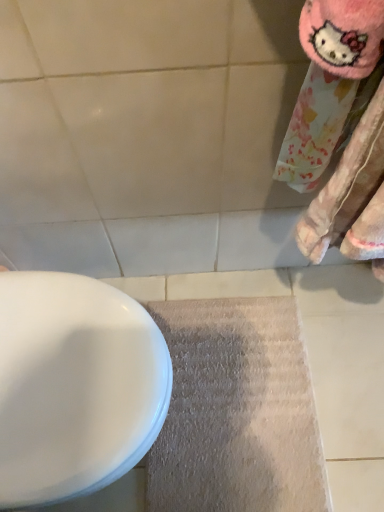
Identify the location of white glossy toilet at lower left. (75, 386).

This screenshot has width=384, height=512. What do you see at coordinates (75, 386) in the screenshot?
I see `white glossy toilet at lower left` at bounding box center [75, 386].

You are a GUI agent. You are given a task and a screenshot of the screen. Output one action in this format:
    pyautogui.click(x=<x>, y=<y>)
    Task: Click on the gray carpet at lower center
    
    Given the screenshot: What is the action you would take?
    pyautogui.click(x=236, y=411)

This screenshot has height=512, width=384. What do you see at coordinates (236, 411) in the screenshot?
I see `gray carpet at lower center` at bounding box center [236, 411].

Where is `white glossy toilet at lower left`? white glossy toilet at lower left is located at coordinates (75, 386).

In the image, is white glossy toilet at lower left on the left side or the right side of gray carpet at lower center?

Clearly, white glossy toilet at lower left is on the left of gray carpet at lower center in the image.

Is the position of white glossy toilet at lower left less distant than that of gray carpet at lower center?

That is True.

Considering the positions of point (102, 409) and point (310, 417), is point (102, 409) closer or farther from the camera than point (310, 417)?

Point (102, 409) is closer to the camera than point (310, 417).

From the image's perspective, is white glossy toilet at lower left on gray carpet at lower center?

Yes.

From a real-world perspective, who is located lower, white glossy toilet at lower left or gray carpet at lower center?

In real-world perspective, gray carpet at lower center is lower.

Is white glossy toilet at lower left wider or thinner than gray carpet at lower center?

Clearly, white glossy toilet at lower left has more width compared to gray carpet at lower center.

Can you confirm if white glossy toilet at lower left is taller than gray carpet at lower center?

Yes.

Considering the relative sizes of white glossy toilet at lower left and gray carpet at lower center in the image provided, is white glossy toilet at lower left bigger than gray carpet at lower center?

Yes, white glossy toilet at lower left is bigger than gray carpet at lower center.

Is gray carpet at lower center surrounded by white glossy toilet at lower left?

No, gray carpet at lower center is not surrounded by white glossy toilet at lower left.

Are white glossy toilet at lower left and gray carpet at lower center far apart?

white glossy toilet at lower left is near gray carpet at lower center, not far away.

Is white glossy toilet at lower left turned away from gray carpet at lower center?

white glossy toilet at lower left does not have its back to gray carpet at lower center.

Looking at this image, what's the angular difference between white glossy toilet at lower left and gray carpet at lower center's facing directions?

The facing directions of white glossy toilet at lower left and gray carpet at lower center are 0.00103 degrees apart.

At what (x,y) coordinates should I click in order to perform the action: click on toilet in front of the gray carpet at lower center. Please return your answer as a coordinate pair (x, y). Looking at the image, I should click on (75, 386).

Looking at this image, is gray carpet at lower center at the right side of white glossy toilet at lower left?

Indeed, gray carpet at lower center is positioned on the right side of white glossy toilet at lower left.

Between gray carpet at lower center and white glossy toilet at lower left, which one is positioned behind?

gray carpet at lower center is further from the camera.

Is point (166, 306) closer or farther from the camera than point (51, 501)?

Point (166, 306) is positioned farther from the camera compared to point (51, 501).

From the image's perspective, is gray carpet at lower center on white glossy toilet at lower left?

No, from the image's perspective, gray carpet at lower center is not above white glossy toilet at lower left.

From a real-world perspective, is gray carpet at lower center below white glossy toilet at lower left?

Indeed, from a real-world perspective, gray carpet at lower center is positioned beneath white glossy toilet at lower left.

Is gray carpet at lower center wider than white glossy toilet at lower left?

In fact, gray carpet at lower center might be narrower than white glossy toilet at lower left.

Can you confirm if gray carpet at lower center is shorter than white glossy toilet at lower left?

Yes.

Considering the sizes of objects gray carpet at lower center and white glossy toilet at lower left in the image provided, who is smaller, gray carpet at lower center or white glossy toilet at lower left?

gray carpet at lower center.

Would you say gray carpet at lower center contains white glossy toilet at lower left?

No, white glossy toilet at lower left is not surrounded by gray carpet at lower center.

Are gray carpet at lower center and white glossy toilet at lower left beside each other?

No.

Is gray carpet at lower center facing away from white glossy toilet at lower left?

Yes.

Where is `toilet that is above the gray carpet at lower center (from the image's perspective)`? The width and height of the screenshot is (384, 512). toilet that is above the gray carpet at lower center (from the image's perspective) is located at coordinates (75, 386).

In order to click on doormat behind the white glossy toilet at lower left in this screenshot , I will do `click(236, 411)`.

Locate an element on the screen. toilet that appears above the gray carpet at lower center (from the image's perspective) is located at coordinates (75, 386).